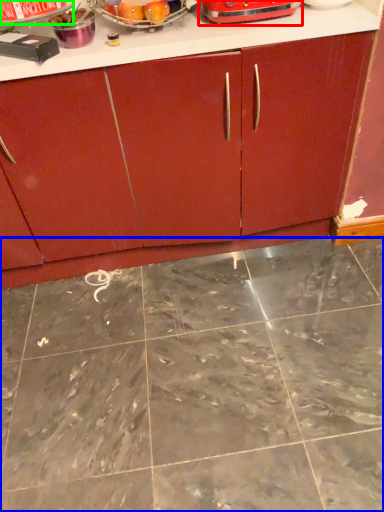
Question: Which object is positioned closest to appliance (highlighted by a red box)? Select from granite (highlighted by a blue box) and appliance (highlighted by a green box).

Choices:
 (A) granite
 (B) appliance

Answer: (B)